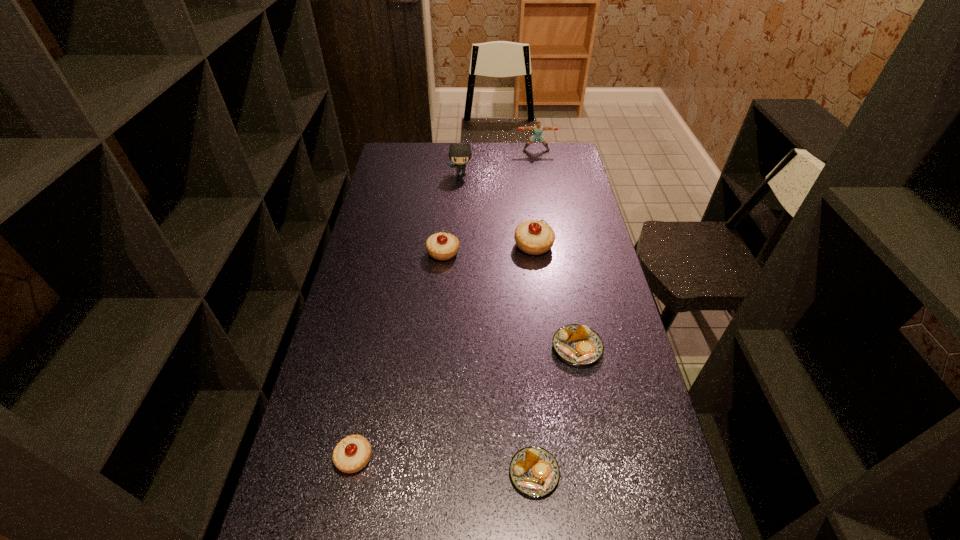
You are a GUI agent. You are given a task and a screenshot of the screen. Output one action in this format:
    pyautogui.click(x=<x>, y=<y>)
    Task: Click on the vacant point located between the fifth tallest object and the second beige pastry from right to left
    This screenshot has width=960, height=540.
    Given the screenshot: What is the action you would take?
    pyautogui.click(x=398, y=355)

Identify the location of free spot between the farthest object and the left brown pastry. This screenshot has width=960, height=540. (535, 312).

Find the location of a particular element. The width and height of the screenshot is (960, 540). free spot between the second farthest object and the left brown pastry is located at coordinates [x=497, y=323].

The width and height of the screenshot is (960, 540). I want to click on unoccupied position between the bigger brown pastry and the fourth shortest pastry, so click(x=510, y=300).

The image size is (960, 540). Identify the location of vacant space that's between the leftmost object and the second shortest object. (466, 403).

Identify the location of vacant space that is in between the shortest object and the nearest beige pastry. Image resolution: width=960 pixels, height=540 pixels. (x=444, y=465).

Where is `free space between the third tallest pastry and the kitten`? free space between the third tallest pastry and the kitten is located at coordinates (408, 315).

Locate an element on the screen. This screenshot has height=540, width=960. vacant area that lies between the red puncher and the fourth tallest pastry is located at coordinates (557, 249).

Identify which object is the third nearest to the leftmost beige pastry. Please provide its 2D coordinates. Your answer should be formatted as a tuple, i.e. [(x, y)], where the tuple contains the x and y coordinates of a point satisfying the conditions above.

[(441, 246)]

Locate which object is the third closest to the kitten. Please provide its 2D coordinates. Your answer should be formatted as a tuple, i.e. [(x, y)], where the tuple contains the x and y coordinates of a point satisfying the conditions above.

[(441, 246)]